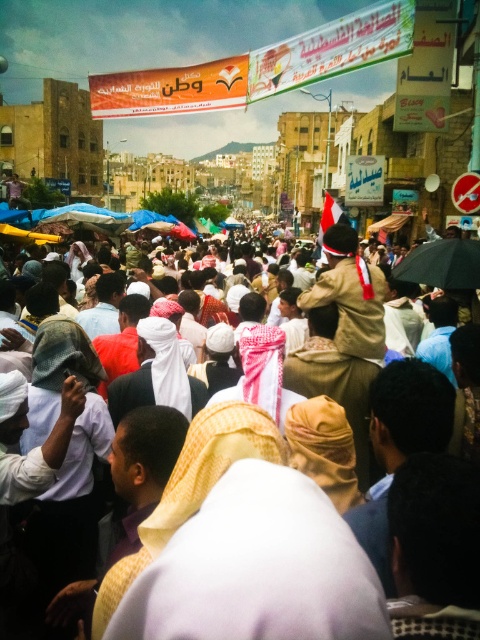
In the scene shown: You are a photographer trying to capture a clear shot of the white cloth at center and the black matte umbrella at center. Since you want both objects in focus, you need to adjust your camera settings so that the depth of field can cover both. Given their heights, which object should you focus on to ensure both are sharp?

The white cloth at center is taller than the black matte umbrella at center. To ensure both are in focus, you should focus on the black matte umbrella at center since it is closer to the camera, and the depth of field will extend backward to cover the taller object.

You are a photographer trying to capture a clear shot of the white cloth at center and the black matte umbrella at center. Since they are both at the center, you need to adjust your camera angle to focus on one. Which object should you aim for first if you want to ensure the larger object is in frame?

The white cloth at center has a greater width than the black matte umbrella at center, so you should aim for the white cloth at center first to ensure the larger object is in frame.

You are standing in the middle of the bustling street scene described. You need to locate the white cloth at center. According to the coordinates provided in the scene description, where exactly should you look to find it?

The white cloth at center is located at point 0.906 on the x axis and 0.515 on the y axis.